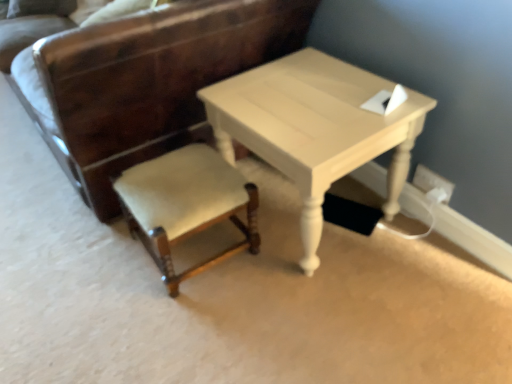
This screenshot has height=384, width=512. I want to click on free spot above light beige wood table at center (from a real-world perspective), so click(x=313, y=97).